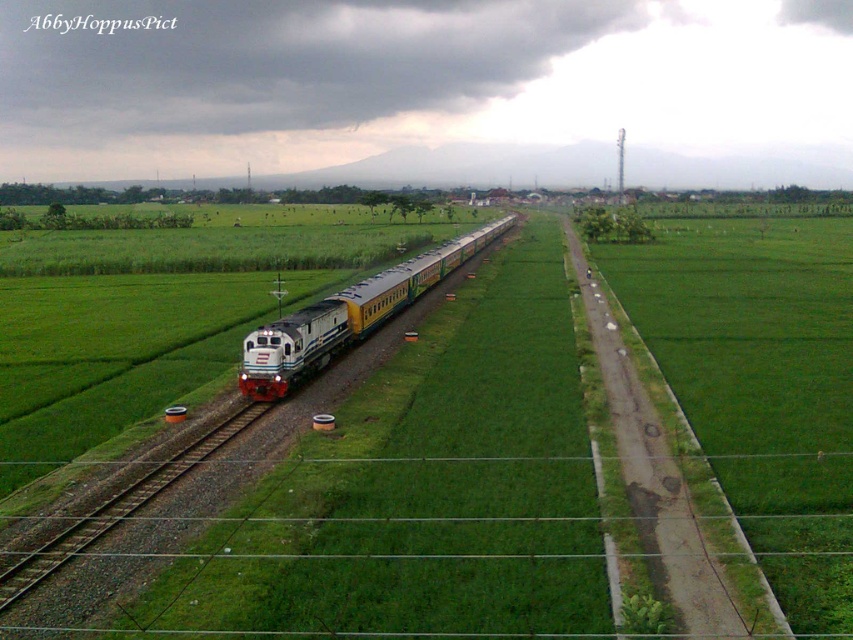
You are standing at the point with coordinates 0.5, 0.5 in the image. Which direction should you move to reach the green grass field at center?

The green grass field at center is located at point [389,493]. Since your current position is at [426,320], you should move towards the northeast direction to reach it.